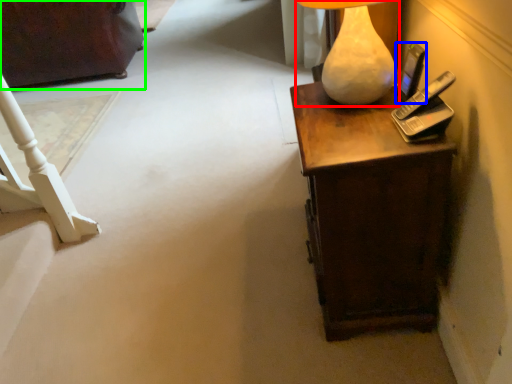
Question: Which object is the closest to the lamp (highlighted by a red box)? Choose among these: mobile phone (highlighted by a blue box) or furniture (highlighted by a green box).

Choices:
 (A) mobile phone
 (B) furniture

Answer: (A)